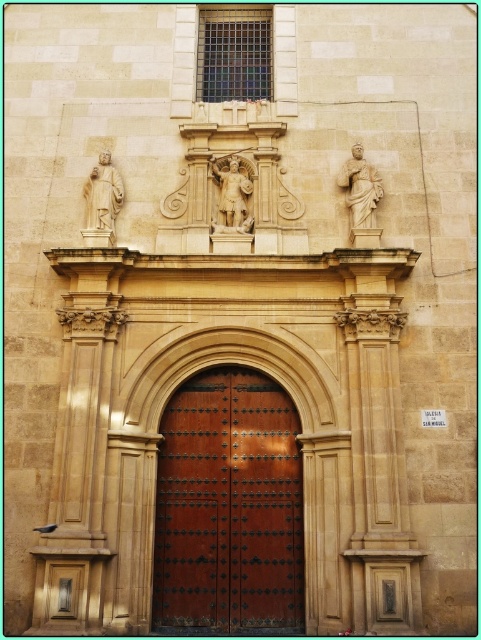
You are standing in front of the historic church entrance. The coordinates of the brown wooden door at center are given as point (228, 506). If you want to enter the church, which direction should you move relative to your current position?

The brown wooden door at center is located at point (228, 506), so you should move towards that coordinate to enter the church.

You are a delivery person with a cart that can carry items up to 65 feet. You need to move a heavy package from the brown wooden door at center to the light beige stone statue at upper left. Can your cart handle the distance?

The distance between the brown wooden door at center and the light beige stone statue at upper left is 64.61 feet, which is within the cart capacity of 65 feet. Therefore, the cart can handle the distance.

You are an architect examining the building facade. You need to determine if the brown wooden door at center can be covered by a protective tarp that is the same size as the light beige stone statue at upper left. Can the tarp cover the door completely?

The brown wooden door at center is bigger than the light beige stone statue at upper left. Therefore, the tarp, which is the same size as the statue, cannot fully cover the door.